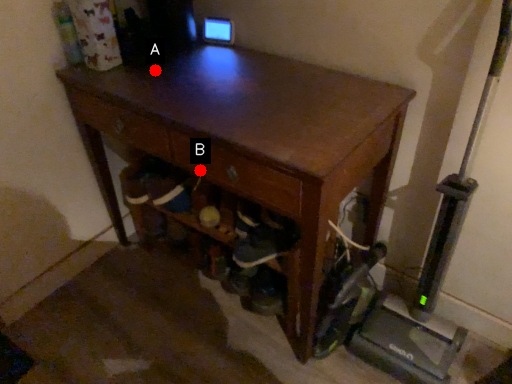
Question: Two points are circled on the image, labeled by A and B beside each circle. Which point is closer to the camera?

Choices:
 (A) A is closer
 (B) B is closer

Answer: (B)